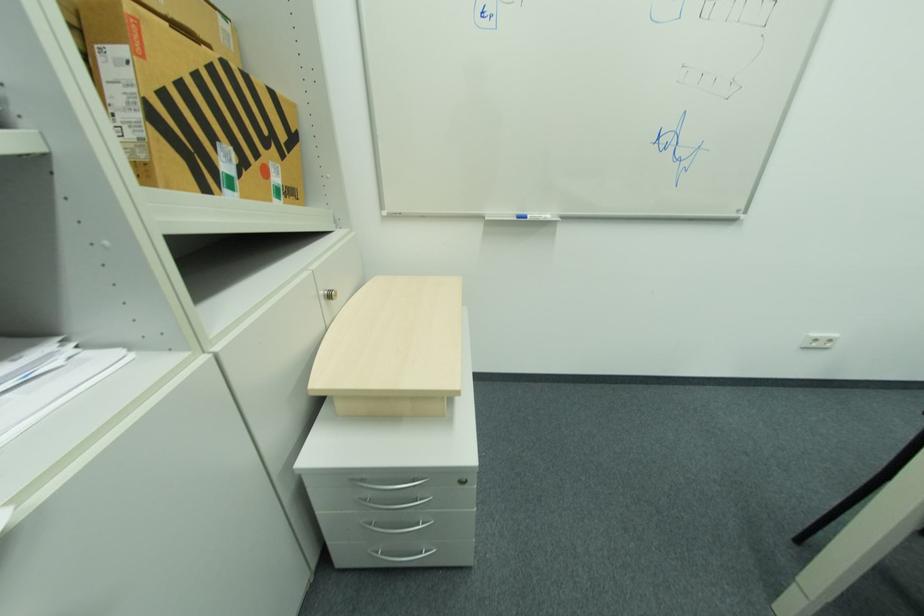
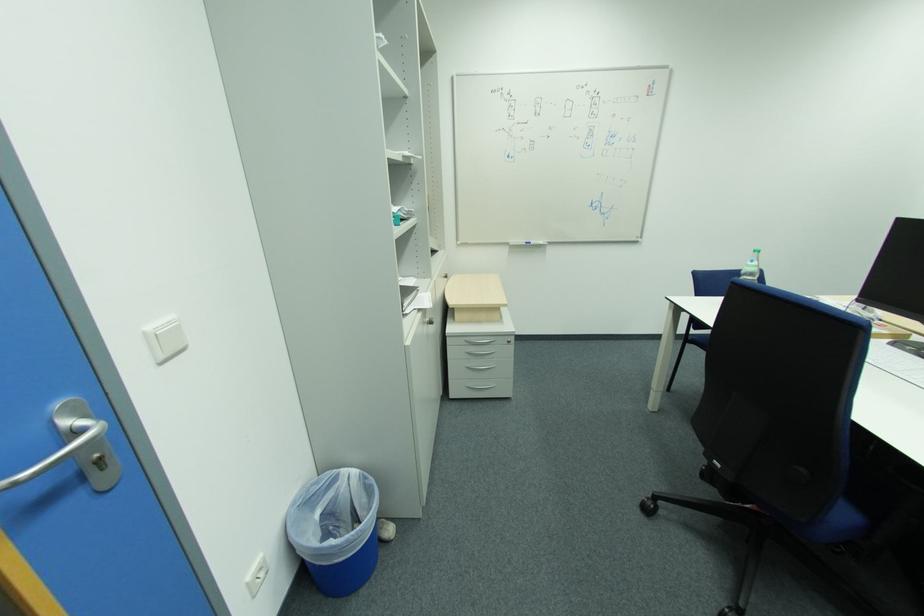
Locate, in the second image, the point that corresponds to (553,217) in the first image.

(546, 244)